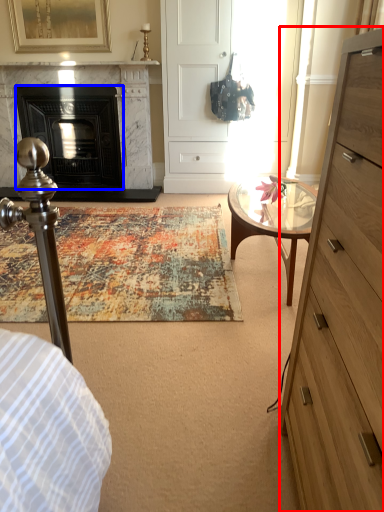
Question: Which point is further to the camera, chest of drawers (highlighted by a red box) or fireplace (highlighted by a blue box)?

Choices:
 (A) chest of drawers
 (B) fireplace

Answer: (B)